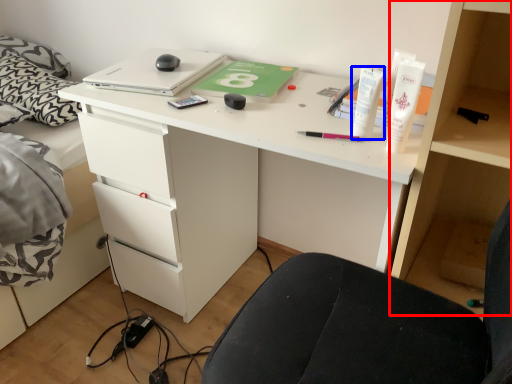
Question: Which object appears farthest to the camera in this image, bookshelf (highlighted by a red box) or toiletry (highlighted by a blue box)?

Choices:
 (A) bookshelf
 (B) toiletry

Answer: (B)